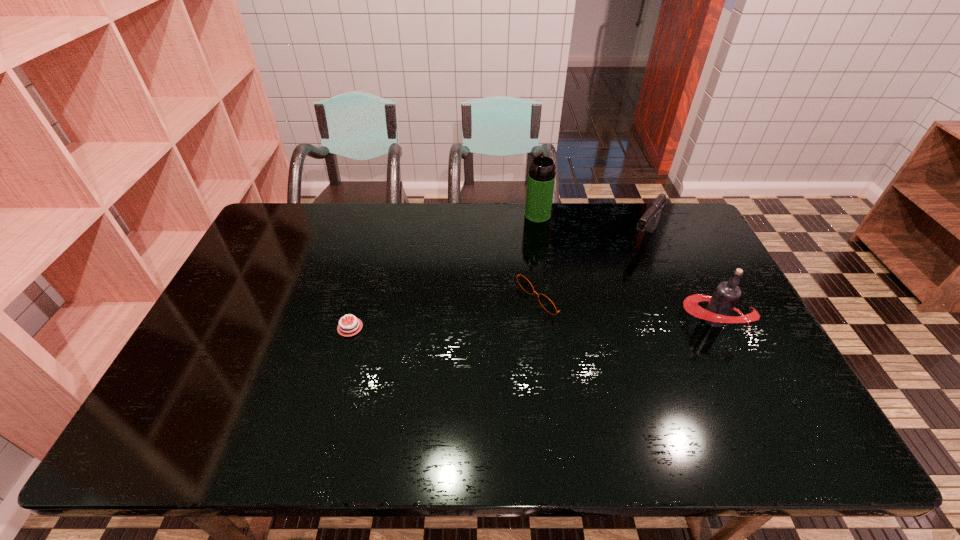
The width and height of the screenshot is (960, 540). Identify the location of vacant space on the desktop that is between the leftmost object and the root beer and is positioned aim along the barrel of the second farthest object. (581, 322).

Identify the location of vacant space on the desktop that is between the chocolate cake and the fourth shortest object and is positioned from the spout of the farthest object. The width and height of the screenshot is (960, 540). (x=499, y=325).

Where is `vacant space on the desktop that is between the leftmost object and the root beer and is positioned on the face of the second shortest object`? vacant space on the desktop that is between the leftmost object and the root beer and is positioned on the face of the second shortest object is located at coordinates (492, 325).